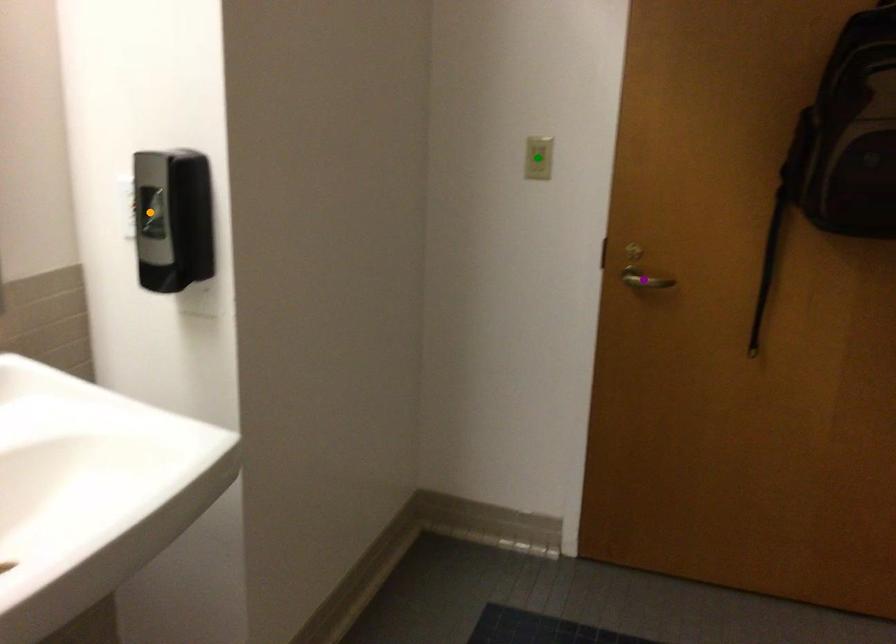
Order these from nearest to farthest:
green point
purple point
orange point

orange point < purple point < green point